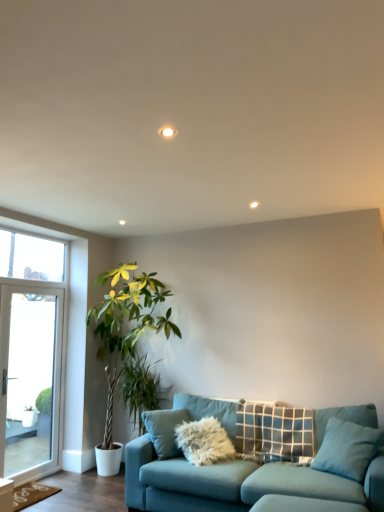
Question: Does plaid fabric pillow at center, marked as the first pillow in a back-to-front arrangement, appear on the right side of clear glass door at left?

Choices:
 (A) no
 (B) yes

Answer: (B)

Question: Is plaid fabric pillow at center, marked as the first pillow in a back-to-front arrangement, not inside clear glass door at left?

Choices:
 (A) yes
 (B) no

Answer: (A)

Question: Is plaid fabric pillow at center, which ranks as the second pillow in front-to-back order, bigger than clear glass door at left?

Choices:
 (A) yes
 (B) no

Answer: (A)

Question: Is plaid fabric pillow at center, which ranks as the second pillow in front-to-back order, far away from clear glass door at left?

Choices:
 (A) no
 (B) yes

Answer: (B)

Question: Is plaid fabric pillow at center, which ranks as the second pillow in front-to-back order, with clear glass door at left?

Choices:
 (A) yes
 (B) no

Answer: (B)

Question: Considering the positions of green leafy plant at left and blue fabric pillow at lower right, acting as the second pillow starting from the back, in the image, is green leafy plant at left taller or shorter than blue fabric pillow at lower right, acting as the second pillow starting from the back,?

Choices:
 (A) tall
 (B) short

Answer: (A)

Question: Which is correct: green leafy plant at left is inside blue fabric pillow at lower right, which appears as the first pillow when viewed from the front, or outside of it?

Choices:
 (A) outside
 (B) inside

Answer: (A)

Question: In the image, is green leafy plant at left on the left side or the right side of blue fabric pillow at lower right, acting as the second pillow starting from the back?

Choices:
 (A) left
 (B) right

Answer: (A)

Question: From a real-world perspective, is green leafy plant at left positioned above or below blue fabric pillow at lower right, which appears as the first pillow when viewed from the front?

Choices:
 (A) above
 (B) below

Answer: (A)

Question: Would you say clear glass door at left is to the left or to the right of blue fabric pillow at lower right, which appears as the first pillow when viewed from the front, in the picture?

Choices:
 (A) left
 (B) right

Answer: (A)

Question: Considering the positions of clear glass door at left and blue fabric pillow at lower right, acting as the second pillow starting from the back, in the image, is clear glass door at left taller or shorter than blue fabric pillow at lower right, acting as the second pillow starting from the back,?

Choices:
 (A) tall
 (B) short

Answer: (A)

Question: Considering the positions of clear glass door at left and blue fabric pillow at lower right, which appears as the first pillow when viewed from the front, in the image, is clear glass door at left wider or thinner than blue fabric pillow at lower right, which appears as the first pillow when viewed from the front,?

Choices:
 (A) thin
 (B) wide

Answer: (A)

Question: From a real-world perspective, relative to blue fabric pillow at lower right, acting as the second pillow starting from the back, is clear glass door at left vertically above or below?

Choices:
 (A) above
 (B) below

Answer: (A)

Question: Is point coord(243,420) positioned closer to the camera than point coord(6,254)?

Choices:
 (A) closer
 (B) farther

Answer: (A)

Question: Is teal fabric couch at lower center in front of or behind transparent glass window at left in the image?

Choices:
 (A) behind
 (B) front

Answer: (B)